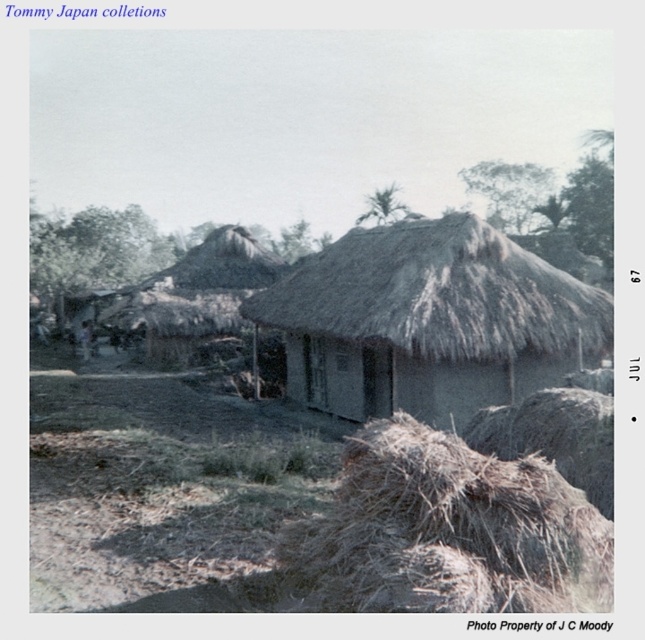
Is thatched straw hut at center to the left of brown straw at lower right from the viewer's perspective?

Indeed, thatched straw hut at center is positioned on the left side of brown straw at lower right.

Can you confirm if thatched straw hut at center is bigger than brown straw at lower right?

Yes.

Where is `thatched straw hut at center`? thatched straw hut at center is located at coordinates click(x=430, y=321).